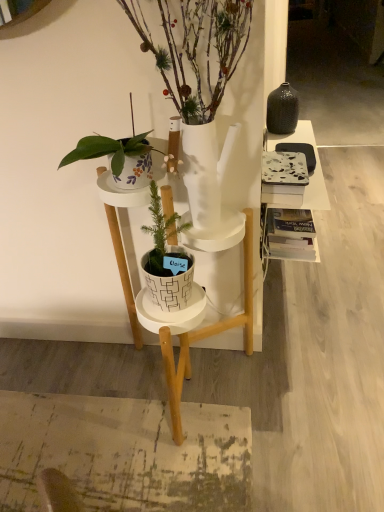
What is the approximate height of marble-patterned book at right?

The height of marble-patterned book at right is 4.04 inches.

What do you see at coordinates (166, 260) in the screenshot? Image resolution: width=384 pixels, height=512 pixels. I see `white textured pot at center, positioned as the first houseplant in bottom-to-top order` at bounding box center [166, 260].

What do you see at coordinates (207, 336) in the screenshot? The height and width of the screenshot is (512, 384). I see `white matte plant stand at center` at bounding box center [207, 336].

Locate an element on the screen. white matte plant stand at center is located at coordinates (207, 336).

Locate an element on the screen. white glossy pot at center, which ranks as the 2th houseplant in bottom-to-top order is located at coordinates (198, 82).

From a real-world perspective, who is located lower, white glossy pot at center, arranged as the 1th houseplant when viewed from the top, or white matte plant stand at center?

From a 3D spatial view, white matte plant stand at center is below.

Is white glossy pot at center, arranged as the 1th houseplant when viewed from the top, at the right side of white matte plant stand at center?

Yes, white glossy pot at center, arranged as the 1th houseplant when viewed from the top, is to the right of white matte plant stand at center.

From the image's perspective, between white glossy pot at center, which ranks as the 2th houseplant in bottom-to-top order, and white matte plant stand at center, which one is located above?

white glossy pot at center, which ranks as the 2th houseplant in bottom-to-top order, appears higher in the image.

From a real-world perspective, is marble-patterned book at right physically above white matte plant stand at center?

Yes, from a real-world perspective, marble-patterned book at right is over white matte plant stand at center

Measure the distance from marble-patterned book at right to white matte plant stand at center.

A distance of 34.05 centimeters exists between marble-patterned book at right and white matte plant stand at center.

Is marble-patterned book at right facing towards white matte plant stand at center?

No, marble-patterned book at right is not aimed at white matte plant stand at center.

This screenshot has width=384, height=512. In order to click on desk located below the marble-patterned book at right (from the image's perspective) in this screenshot , I will do [207, 336].

From the image's perspective, does marble-patterned book at right appear higher than white textured pot at center, marked as the 2th houseplant in a top-to-bottom arrangement?

Yes, from the image's perspective, marble-patterned book at right is on top of white textured pot at center, marked as the 2th houseplant in a top-to-bottom arrangement.

Considering the sizes of objects marble-patterned book at right and white textured pot at center, positioned as the first houseplant in bottom-to-top order, in the image provided, who is thinner, marble-patterned book at right or white textured pot at center, positioned as the first houseplant in bottom-to-top order,?

marble-patterned book at right.

Does point (274, 192) come behind point (152, 200)?

Yes, point (274, 192) is farther from viewer.

Is there a large distance between marble-patterned book at right and white textured pot at center, marked as the 2th houseplant in a top-to-bottom arrangement?

No.

Is point (115, 221) closer or farther from the camera than point (170, 295)?

Point (115, 221).

Looking at the image, does white matte plant stand at center seem bigger or smaller compared to white textured pot at center, marked as the 2th houseplant in a top-to-bottom arrangement?

Clearly, white matte plant stand at center is larger in size than white textured pot at center, marked as the 2th houseplant in a top-to-bottom arrangement.

In the scene shown: From the image's perspective, is white matte plant stand at center located above white textured pot at center, marked as the 2th houseplant in a top-to-bottom arrangement?

No, from the image's perspective, white matte plant stand at center is not above white textured pot at center, marked as the 2th houseplant in a top-to-bottom arrangement.

From a real-world perspective, is white matte plant stand at center above or below white textured pot at center, marked as the 2th houseplant in a top-to-bottom arrangement?

Clearly, from a real-world perspective, white matte plant stand at center is below white textured pot at center, marked as the 2th houseplant in a top-to-bottom arrangement.

From their relative heights in the image, would you say white matte plant stand at center is taller or shorter than white glossy pot at center, which ranks as the 2th houseplant in bottom-to-top order?

In the image, white matte plant stand at center appears to be taller than white glossy pot at center, which ranks as the 2th houseplant in bottom-to-top order.

Is white matte plant stand at center situated inside white glossy pot at center, which ranks as the 2th houseplant in bottom-to-top order, or outside?

white matte plant stand at center lies outside white glossy pot at center, which ranks as the 2th houseplant in bottom-to-top order.

Find the location of a particular element. The image size is (384, 512). desk located underneath the white glossy pot at center, arranged as the 1th houseplant when viewed from the top (from a real-world perspective) is located at coordinates (207, 336).

Are white matte plant stand at center and white glossy pot at center, arranged as the 1th houseplant when viewed from the top, located far from each other?

That's not correct — white matte plant stand at center is a little close to white glossy pot at center, arranged as the 1th houseplant when viewed from the top.

Can you confirm if white glossy pot at center, arranged as the 1th houseplant when viewed from the top, is positioned to the left of white textured pot at center, positioned as the first houseplant in bottom-to-top order?

No.

This screenshot has width=384, height=512. Find the location of `houseplant that appears above the white textured pot at center, marked as the 2th houseplant in a top-to-bottom arrangement (from a real-world perspective)`. houseplant that appears above the white textured pot at center, marked as the 2th houseplant in a top-to-bottom arrangement (from a real-world perspective) is located at coordinates (198, 82).

From the image's perspective, is white glossy pot at center, arranged as the 1th houseplant when viewed from the top, beneath white textured pot at center, marked as the 2th houseplant in a top-to-bottom arrangement?

Incorrect, from the image's perspective, white glossy pot at center, arranged as the 1th houseplant when viewed from the top, is higher than white textured pot at center, marked as the 2th houseplant in a top-to-bottom arrangement.

How distant is white glossy pot at center, which ranks as the 2th houseplant in bottom-to-top order, from white textured pot at center, positioned as the first houseplant in bottom-to-top order?

They are 9.14 inches apart.

Is white textured pot at center, positioned as the first houseplant in bottom-to-top order, not close to white matte plant stand at center?

No.

Considering the relative sizes of white textured pot at center, marked as the 2th houseplant in a top-to-bottom arrangement, and white matte plant stand at center in the image provided, is white textured pot at center, marked as the 2th houseplant in a top-to-bottom arrangement, smaller than white matte plant stand at center?

Yes.

Relative to white matte plant stand at center, is white textured pot at center, positioned as the first houseplant in bottom-to-top order, in front or behind?

In the image, white textured pot at center, positioned as the first houseplant in bottom-to-top order, appears behind white matte plant stand at center.

Which is more to the left, white textured pot at center, positioned as the first houseplant in bottom-to-top order, or white matte plant stand at center?

From the viewer's perspective, white textured pot at center, positioned as the first houseplant in bottom-to-top order, appears more on the left side.

Locate an element on the screen. houseplant in front of the white matte plant stand at center is located at coordinates (198, 82).

The image size is (384, 512). In order to click on desk below the marble-patterned book at right (from the image's perspective) in this screenshot , I will do `click(207, 336)`.

Based on the photo, when comparing their distances from white textured pot at center, positioned as the first houseplant in bottom-to-top order, does white matte plant stand at center or white glossy pot at center, which ranks as the 2th houseplant in bottom-to-top order, seem further?

white glossy pot at center, which ranks as the 2th houseplant in bottom-to-top order, lies further to white textured pot at center, positioned as the first houseplant in bottom-to-top order, than the other object.

In the scene shown: Estimate the real-world distances between objects in this image. Which object is further from white matte plant stand at center, white textured pot at center, positioned as the first houseplant in bottom-to-top order, or marble-patterned book at right?

marble-patterned book at right.

Based on the photo, based on their spatial positions, is white glossy pot at center, which ranks as the 2th houseplant in bottom-to-top order, or marble-patterned book at right further from white textured pot at center, positioned as the first houseplant in bottom-to-top order?

marble-patterned book at right lies further to white textured pot at center, positioned as the first houseplant in bottom-to-top order, than the other object.

Considering their positions, is marble-patterned book at right positioned closer to white textured pot at center, marked as the 2th houseplant in a top-to-bottom arrangement, than white matte plant stand at center?

The object closer to white textured pot at center, marked as the 2th houseplant in a top-to-bottom arrangement, is white matte plant stand at center.

Estimate the real-world distances between objects in this image. Which object is closer to marble-patterned book at right, white matte plant stand at center or white glossy pot at center, which ranks as the 2th houseplant in bottom-to-top order?

white glossy pot at center, which ranks as the 2th houseplant in bottom-to-top order.

From the image, which object appears to be farther from white matte plant stand at center, white glossy pot at center, arranged as the 1th houseplant when viewed from the top, or white textured pot at center, positioned as the first houseplant in bottom-to-top order?

white glossy pot at center, arranged as the 1th houseplant when viewed from the top, lies further to white matte plant stand at center than the other object.

Looking at the image, which one is located further to white textured pot at center, marked as the 2th houseplant in a top-to-bottom arrangement, white matte plant stand at center or marble-patterned book at right?

marble-patterned book at right is positioned further to the anchor white textured pot at center, marked as the 2th houseplant in a top-to-bottom arrangement.

When comparing their distances from white matte plant stand at center, does white textured pot at center, positioned as the first houseplant in bottom-to-top order, or white glossy pot at center, which ranks as the 2th houseplant in bottom-to-top order, seem closer?

white textured pot at center, positioned as the first houseplant in bottom-to-top order, is closer to white matte plant stand at center.

The height and width of the screenshot is (512, 384). In order to click on book between white glossy pot at center, which ranks as the 2th houseplant in bottom-to-top order, and white matte plant stand at center from top to bottom in this screenshot , I will do `click(284, 179)`.

I want to click on houseplant located between white glossy pot at center, which ranks as the 2th houseplant in bottom-to-top order, and marble-patterned book at right in the depth direction, so [166, 260].

The height and width of the screenshot is (512, 384). I want to click on houseplant between white glossy pot at center, which ranks as the 2th houseplant in bottom-to-top order, and white matte plant stand at center, in the vertical direction, so click(x=166, y=260).

This screenshot has width=384, height=512. In order to click on houseplant between white matte plant stand at center and marble-patterned book at right from front to back in this screenshot , I will do (166, 260).